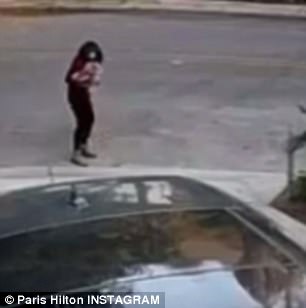
Locate an element on the screen. plant is located at coordinates (300, 183).